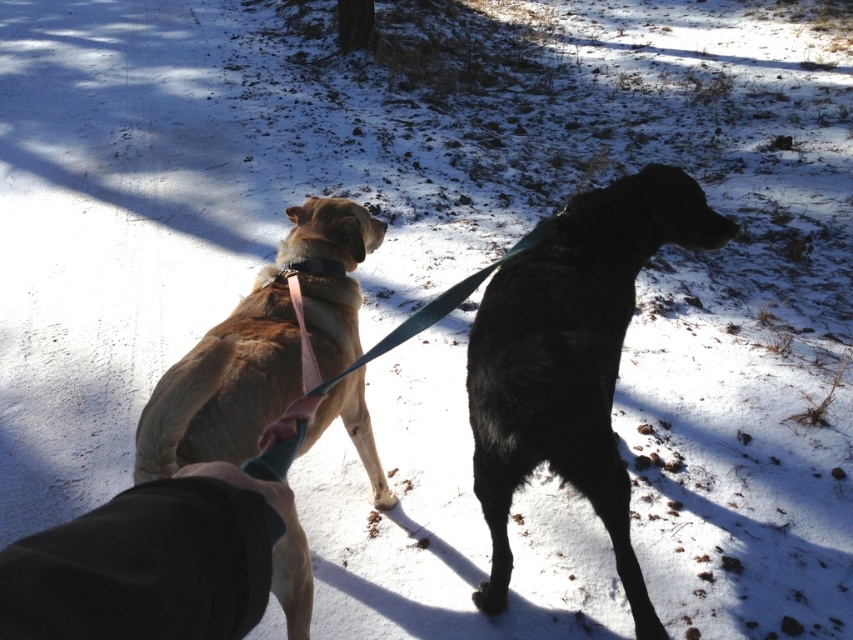
You are a photographer trying to capture the golden fur dog at center in your shot. Based on its 2D coordinates, where should you position your camera to ensure it is centered in the frame?

To center the golden fur dog at center in the frame, position your camera so that the crosshairs align with the coordinates point [260,348].

You are a dog owner trying to attach a new pink fabric neckband at upper center to your golden fur dog at center. Based on the scene, can you reach the neckband from where the dog is standing?

The golden fur dog at center and the pink fabric neckband at upper center are 12.54 inches apart from each other, so yes, you can reach the neckband from where the dog is standing since the distance is within a comfortable reach.